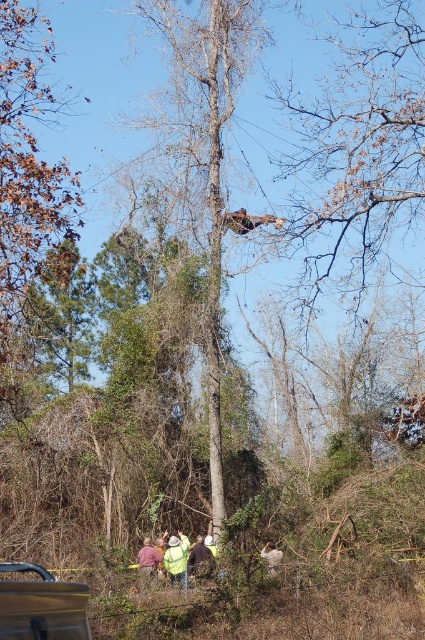
Who is higher up, brown wood tree at upper left or yellow fabric shirt at center?

brown wood tree at upper left is higher up.

Between point (19, 248) and point (192, 552), which one is positioned in front?

Positioned in front is point (19, 248).

The width and height of the screenshot is (425, 640). Find the location of `brown wood tree at upper left`. brown wood tree at upper left is located at coordinates (28, 166).

Who is higher up, bare wood tree at center or yellow fabric shirt at center?

bare wood tree at center is higher up.

Between bare wood tree at center and yellow fabric shirt at center, which one appears on the right side from the viewer's perspective?

Positioned to the right is bare wood tree at center.

Locate an element on the screen. Image resolution: width=425 pixels, height=640 pixels. bare wood tree at center is located at coordinates (207, 157).

Which is in front, point (201, 35) or point (20, 193)?

Point (20, 193)

Is bare wood tree at center in front of brown wood tree at upper left?

Yes, it is in front of brown wood tree at upper left.

Where is `bare wood tree at center`? bare wood tree at center is located at coordinates (207, 157).